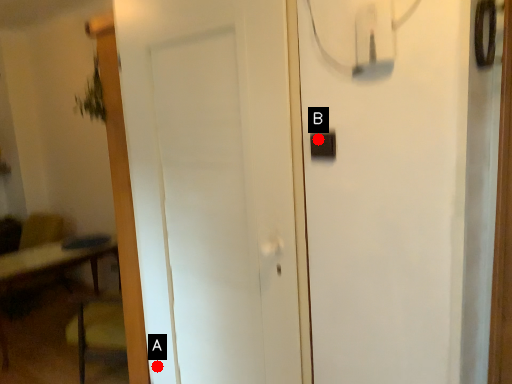
Question: Two points are circled on the image, labeled by A and B beside each circle. Which point is closer to the camera?

Choices:
 (A) A is closer
 (B) B is closer

Answer: (B)